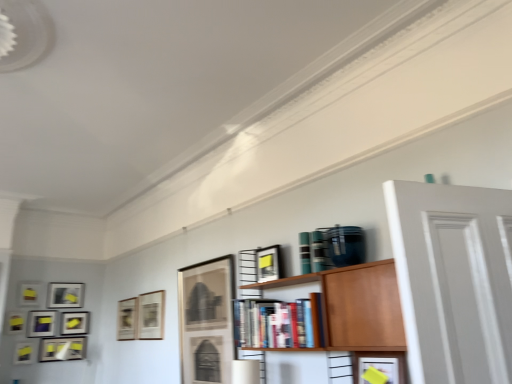
Question: Does matte black picture frame at center, the 9th picture frame in the left-to-right sequence, appear on the left side of matte black picture frame at lower left, which appears as the 3th picture frame when viewed from the left?

Choices:
 (A) no
 (B) yes

Answer: (A)

Question: Is there a large distance between matte black picture frame at center, the 9th picture frame in the left-to-right sequence, and matte black picture frame at lower left, which ranks as the ninth picture frame in right-to-left order?

Choices:
 (A) no
 (B) yes

Answer: (B)

Question: Is matte black picture frame at lower left, which appears as the 3th picture frame when viewed from the left, completely or partially inside matte black picture frame at center, which is the 3th picture frame from right to left?

Choices:
 (A) yes
 (B) no

Answer: (B)

Question: Considering the relative sizes of matte black picture frame at center, the 9th picture frame in the left-to-right sequence, and matte black picture frame at lower left, which ranks as the ninth picture frame in right-to-left order, in the image provided, is matte black picture frame at center, the 9th picture frame in the left-to-right sequence, bigger than matte black picture frame at lower left, which ranks as the ninth picture frame in right-to-left order,?

Choices:
 (A) yes
 (B) no

Answer: (A)

Question: Is matte black picture frame at center, the 9th picture frame in the left-to-right sequence, taller than matte black picture frame at lower left, which ranks as the ninth picture frame in right-to-left order?

Choices:
 (A) no
 (B) yes

Answer: (B)

Question: Relative to matte black picture frame at left, which is the 5th picture frame in left-to-right order, is matte black picture frame at lower left, which appears as the 3th picture frame when viewed from the left, in front or behind?

Choices:
 (A) behind
 (B) front

Answer: (B)

Question: Looking at their shapes, would you say matte black picture frame at lower left, which ranks as the ninth picture frame in right-to-left order, is wider or thinner than matte black picture frame at left, which is the 5th picture frame in left-to-right order?

Choices:
 (A) wide
 (B) thin

Answer: (A)

Question: Based on their sizes in the image, would you say matte black picture frame at lower left, which appears as the 3th picture frame when viewed from the left, is bigger or smaller than matte black picture frame at left, which is the 5th picture frame in left-to-right order?

Choices:
 (A) small
 (B) big

Answer: (A)

Question: Is matte black picture frame at lower left, which ranks as the ninth picture frame in right-to-left order, inside the boundaries of matte black picture frame at left, positioned as the seventh picture frame in right-to-left order, or outside?

Choices:
 (A) outside
 (B) inside

Answer: (A)

Question: Is matte black picture frame at left, positioned as the seventh picture frame in right-to-left order, inside or outside of matte black picture frame at upper left, which is counted as the second picture frame, starting from the left?

Choices:
 (A) inside
 (B) outside

Answer: (B)

Question: Relative to matte black picture frame at upper left, the tenth picture frame when ordered from right to left, is matte black picture frame at left, which is the 5th picture frame in left-to-right order, in front or behind?

Choices:
 (A) front
 (B) behind

Answer: (B)

Question: From a real-world perspective, relative to matte black picture frame at upper left, which is counted as the second picture frame, starting from the left, is matte black picture frame at left, positioned as the seventh picture frame in right-to-left order, vertically above or below?

Choices:
 (A) above
 (B) below

Answer: (B)

Question: Does point (74, 291) appear closer or farther from the camera than point (41, 286)?

Choices:
 (A) farther
 (B) closer

Answer: (A)

Question: Choose the correct answer: Is matte black picture frame at upper left, the tenth picture frame when ordered from right to left, inside hardcover books at center or outside it?

Choices:
 (A) outside
 (B) inside

Answer: (A)

Question: Is matte black picture frame at upper left, which is counted as the second picture frame, starting from the left, bigger or smaller than hardcover books at center?

Choices:
 (A) big
 (B) small

Answer: (B)